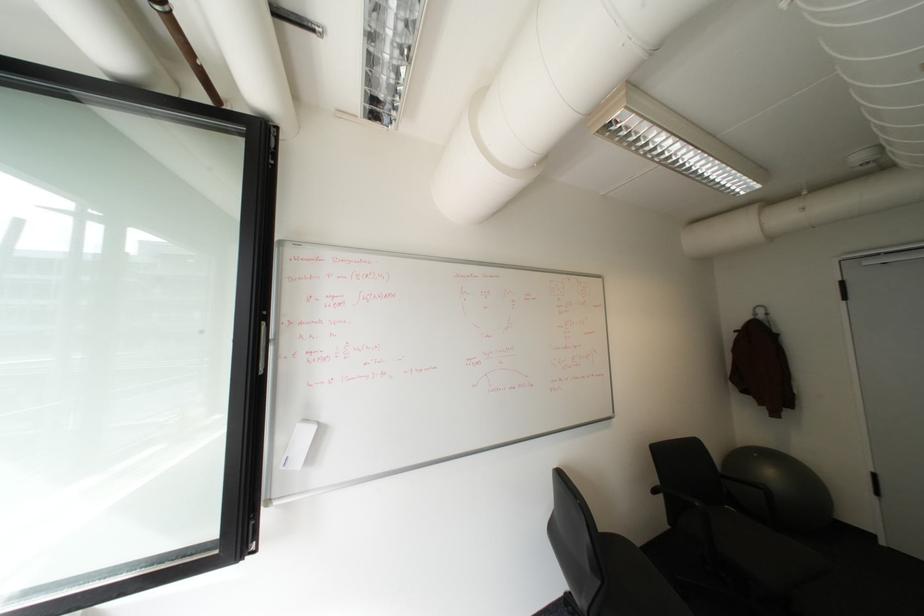
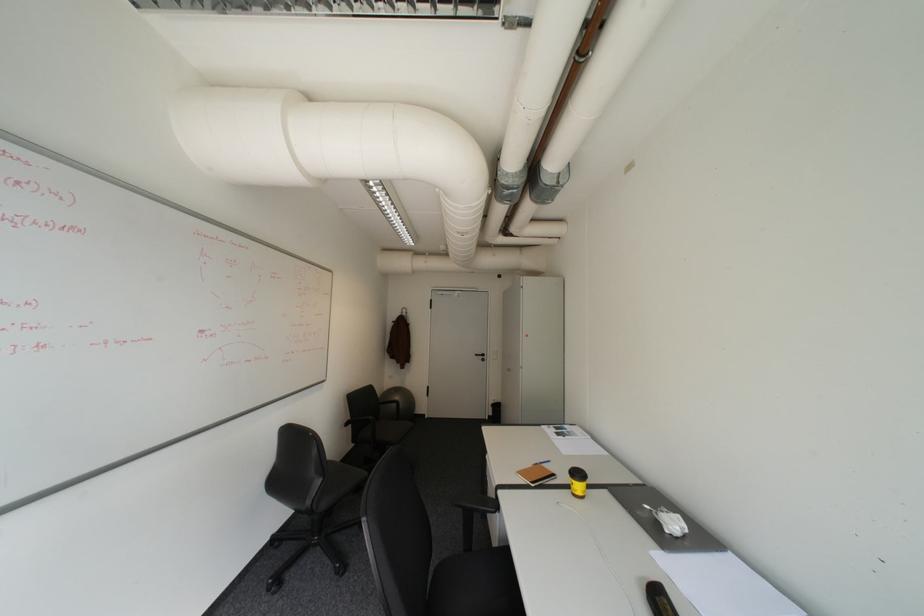
Find the pixel in the second image that matches [779,474] in the first image.

(407, 399)